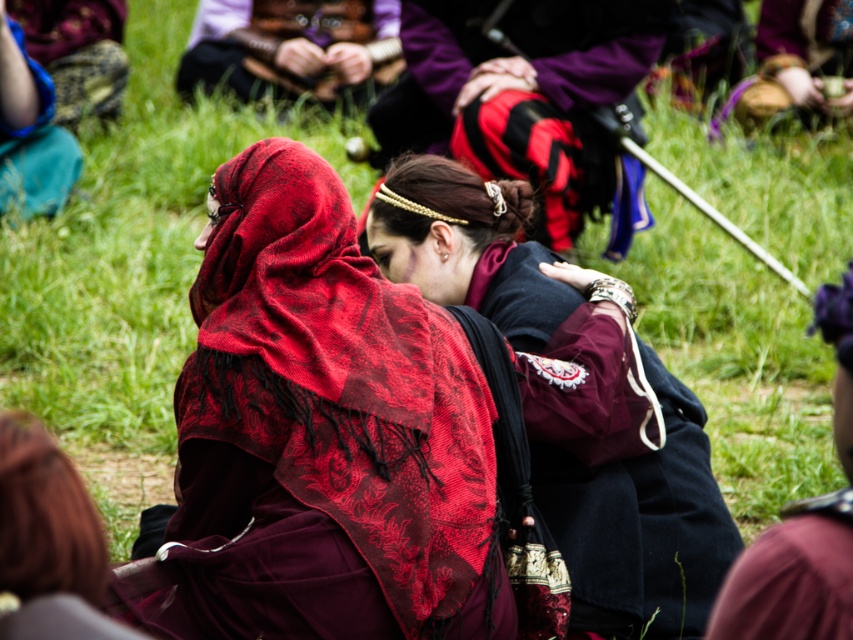
Question: Which object is farther from the camera taking this photo?

Choices:
 (A) velvet burgundy dress at center
 (B) velvet maroon dress at center

Answer: (A)

Question: Can you confirm if velvet maroon dress at center is bigger than velvet burgundy dress at center?

Choices:
 (A) yes
 (B) no

Answer: (B)

Question: Is velvet maroon dress at center positioned at the back of velvet burgundy dress at center?

Choices:
 (A) no
 (B) yes

Answer: (A)

Question: Can you confirm if velvet maroon dress at center is smaller than velvet burgundy dress at center?

Choices:
 (A) no
 (B) yes

Answer: (B)

Question: Which object is closer to the camera taking this photo?

Choices:
 (A) velvet burgundy dress at center
 (B) velvet maroon dress at center

Answer: (B)